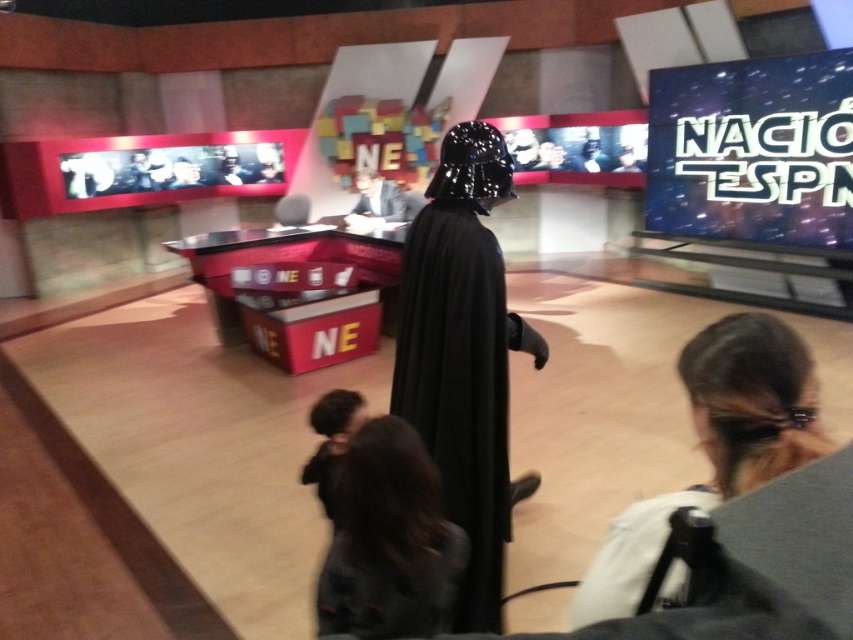
Who is more distant from viewer, [764,419] or [366,593]?

Positioned behind is point [366,593].

Is dark brown hair at lower right further to camera compared to dark brown hair at lower center?

That is False.

Between point (630, 572) and point (399, 579), which one is positioned behind?

The point (399, 579) is more distant.

The height and width of the screenshot is (640, 853). I want to click on dark brown hair at lower right, so click(717, 445).

Is dark brown hair at lower right taller than black matte robe at center?

Indeed, dark brown hair at lower right has a greater height compared to black matte robe at center.

Is dark brown hair at lower right wider than black matte robe at center?

No, dark brown hair at lower right is not wider than black matte robe at center.

The height and width of the screenshot is (640, 853). Find the location of `dark brown hair at lower right`. dark brown hair at lower right is located at coordinates (717, 445).

Who is taller, black matte cape at center or black matte robe at center?

black matte cape at center is taller.

Is point (460, 490) closer to camera compared to point (376, 204)?

Yes, it is.

Where is `black matte cape at center`? black matte cape at center is located at coordinates (463, 355).